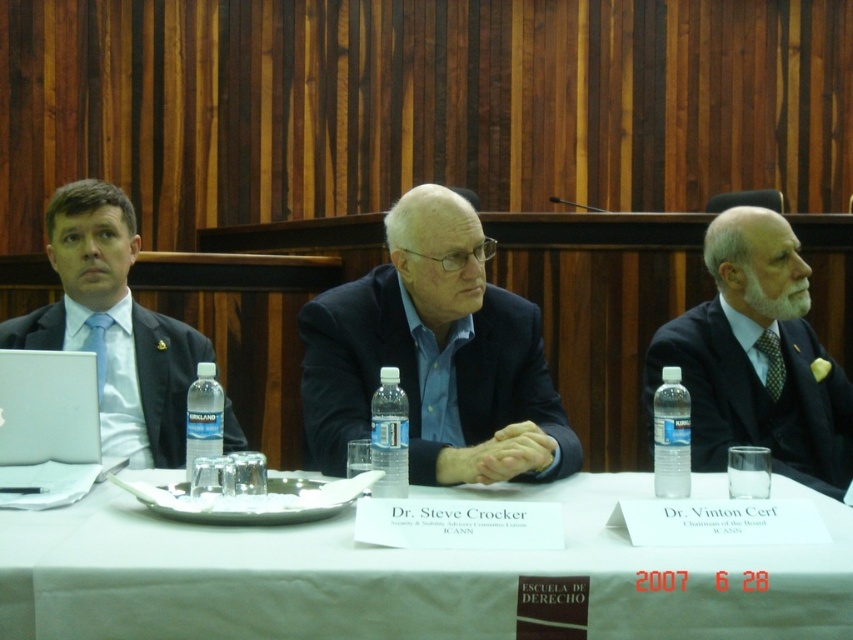
Question: Which point is farther to the camera?

Choices:
 (A) click(659, 480)
 (B) click(502, 461)

Answer: (A)

Question: Estimate the real-world distances between objects in this image. Which object is closer to the matte black suit at left?

Choices:
 (A) white textured suit at right
 (B) white cloth at center

Answer: (B)

Question: Is dark blue suit at center smaller than white textured suit at right?

Choices:
 (A) no
 (B) yes

Answer: (B)

Question: Which point is farther from the camera taking this photo?

Choices:
 (A) (212, 442)
 (B) (375, 468)
 (C) (838, 378)
 (D) (105, 332)

Answer: (C)

Question: Observing the image, what is the correct spatial positioning of clear plastic bottle at right in reference to green textured tie at right?

Choices:
 (A) right
 (B) left

Answer: (B)

Question: Is dark blue suit at center to the right of green textured tie at right from the viewer's perspective?

Choices:
 (A) yes
 (B) no

Answer: (B)